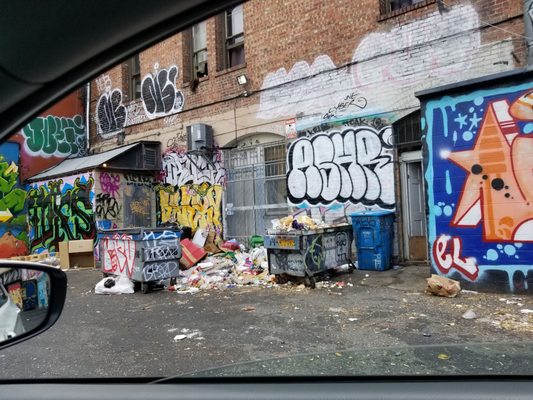
Identify the location of reflection of graffiti in mirror. (22, 283).